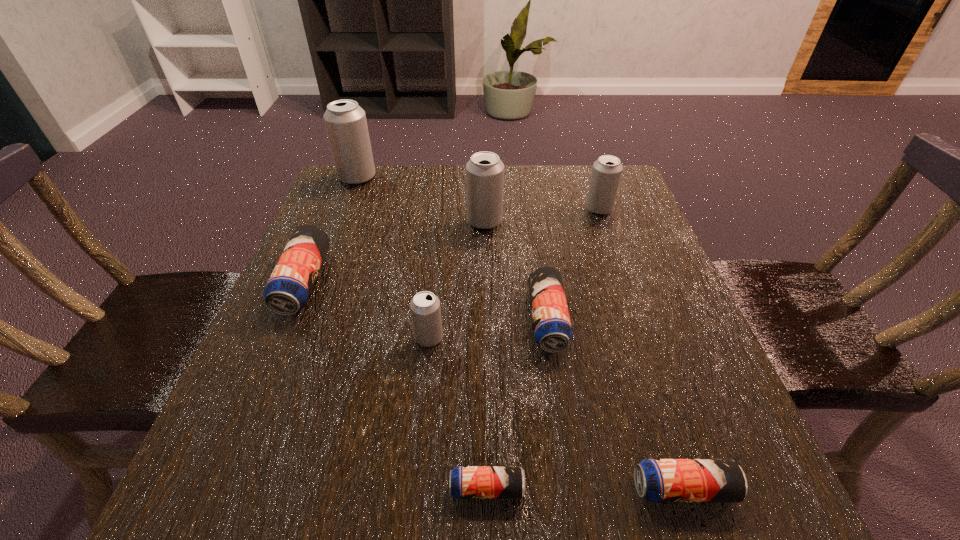
The image size is (960, 540). In order to click on vacant position located 0.070m on the back of the biggest blue beer can in this screenshot , I will do pyautogui.click(x=324, y=232).

The image size is (960, 540). I want to click on free location located on the left of the sixth beer can from left to right, so 321,320.

The width and height of the screenshot is (960, 540). What are the coordinates of `vacant space located on the left of the rightmost blue beer can` in the screenshot? It's located at (458, 489).

Locate an element on the screen. vacant space located 0.090m on the back of the shortest beer can is located at coordinates (487, 415).

Locate an element on the screen. This screenshot has height=540, width=960. object present at the far left corner is located at coordinates (345, 121).

At what (x,y) coordinates should I click in order to perform the action: click on object present at the far right corner. Please return your answer as a coordinate pair (x, y). The height and width of the screenshot is (540, 960). Looking at the image, I should click on [x=606, y=173].

Identify the location of object positioned at the near right corner. (657, 480).

Locate an element on the screen. This screenshot has width=960, height=540. vacant space at the far edge of the desktop is located at coordinates (420, 171).

In the image, there is a desktop. Identify the location of vacant space at the near edge. (605, 494).

At what (x,y) coordinates should I click in order to perform the action: click on blank area at the left edge. Please return your answer as a coordinate pair (x, y). This screenshot has width=960, height=540. Looking at the image, I should click on (378, 233).